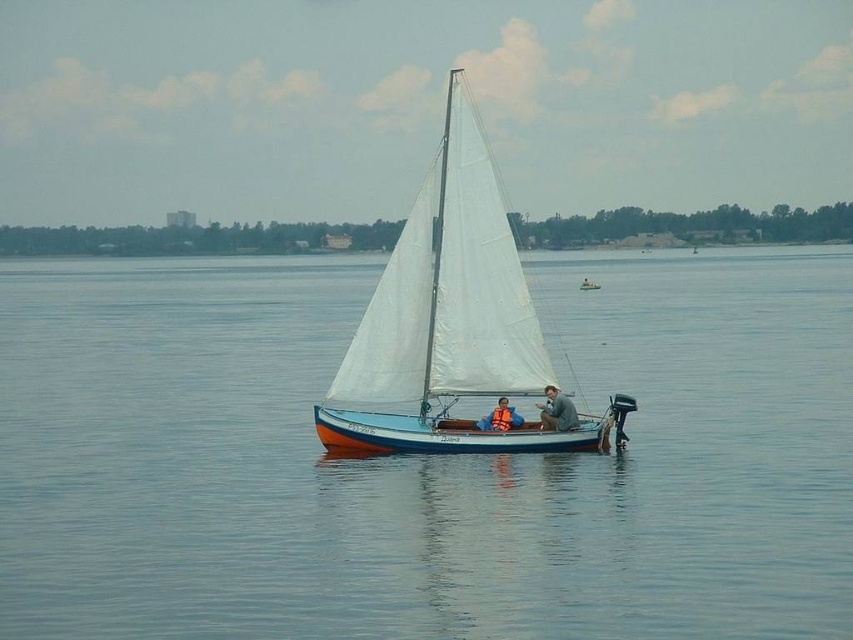
Which of these two, blue smooth water at center or orange life vest at center, stands taller?

blue smooth water at center

Can you confirm if blue smooth water at center is taller than orange life vest at center?

Correct, blue smooth water at center is much taller as orange life vest at center.

At what (x,y) coordinates should I click in order to perform the action: click on blue smooth water at center. Please return your answer as a coordinate pair (x, y). The image size is (853, 640). Looking at the image, I should click on (422, 458).

Is blue smooth water at center further to the viewer compared to blue fabric jacket at center?

That is False.

Identify the location of blue smooth water at center. The height and width of the screenshot is (640, 853). (422, 458).

The width and height of the screenshot is (853, 640). What are the coordinates of `blue smooth water at center` in the screenshot? It's located at (422, 458).

Find the location of a particular element. white sailcloth sailboat at center is located at coordinates (451, 321).

Is white sailcloth sailboat at center thinner than blue fabric jacket at center?

Incorrect, white sailcloth sailboat at center's width is not less than blue fabric jacket at center's.

Between point (509, 371) and point (555, 401), which one is positioned behind?

The point (509, 371) is behind.

You are a GUI agent. You are given a task and a screenshot of the screen. Output one action in this format:
    pyautogui.click(x=<x>, y=<y>)
    Task: Click on the white sailcloth sailboat at center
    The height and width of the screenshot is (640, 853).
    Given the screenshot: What is the action you would take?
    point(451,321)